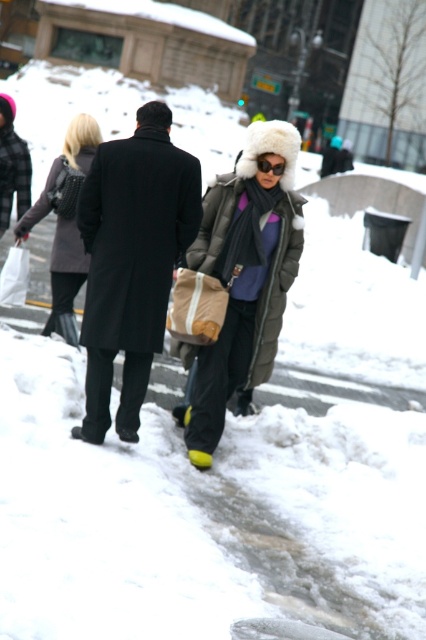
Question: Does matte black coat at upper left have a smaller size compared to black matte sunglasses at center?

Choices:
 (A) no
 (B) yes

Answer: (A)

Question: Which is farther from the black wool coat at center?

Choices:
 (A) matte black coat at upper left
 (B) matte green puffer coat at center
 (C) black matte sunglasses at center

Answer: (A)

Question: Can you confirm if black wool coat at center is positioned above black matte sunglasses at center?

Choices:
 (A) no
 (B) yes

Answer: (A)

Question: Which point is farther from the camera taking this photo?

Choices:
 (A) (63, 237)
 (B) (255, 138)

Answer: (A)

Question: Is matte black coat at upper left behind black matte sunglasses at center?

Choices:
 (A) yes
 (B) no

Answer: (A)

Question: Estimate the real-world distances between objects in this image. Which object is farther from the matte black coat at upper left?

Choices:
 (A) black wool coat at center
 (B) matte green puffer coat at center
 (C) black matte sunglasses at center

Answer: (C)